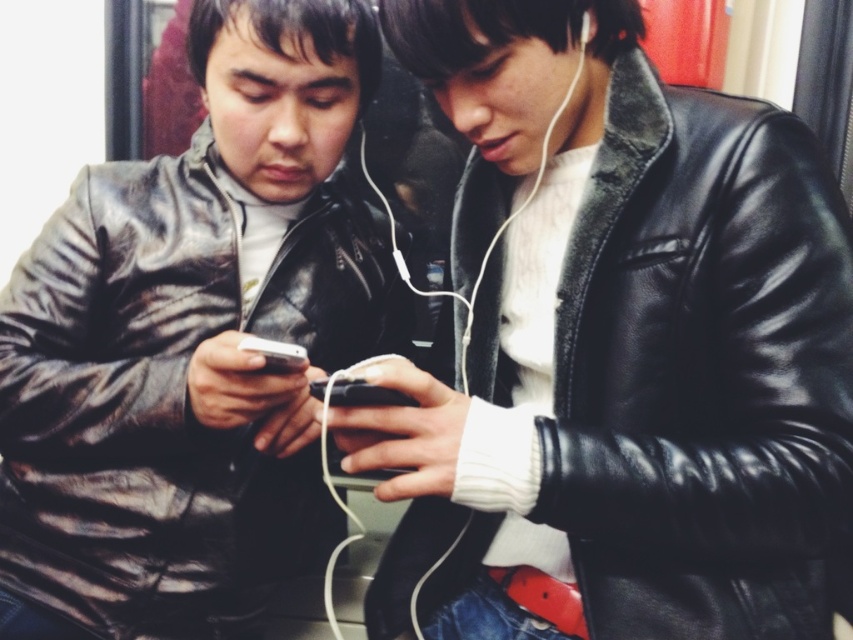
Question: In this image, where is matte black jacket at center located relative to black leather jacket at center?

Choices:
 (A) below
 (B) above

Answer: (B)

Question: Can you confirm if matte black jacket at center is thinner than black leather jacket at center?

Choices:
 (A) no
 (B) yes

Answer: (B)

Question: Which point appears closest to the camera in this image?

Choices:
 (A) (474, 156)
 (B) (94, 376)

Answer: (B)

Question: Which of the following is the closest to the observer?

Choices:
 (A) matte black jacket at center
 (B) black leather jacket at center

Answer: (B)

Question: Which of the following is the farthest from the observer?

Choices:
 (A) (177, 275)
 (B) (543, 506)

Answer: (A)

Question: Is matte black jacket at center wider than black leather jacket at center?

Choices:
 (A) no
 (B) yes

Answer: (A)